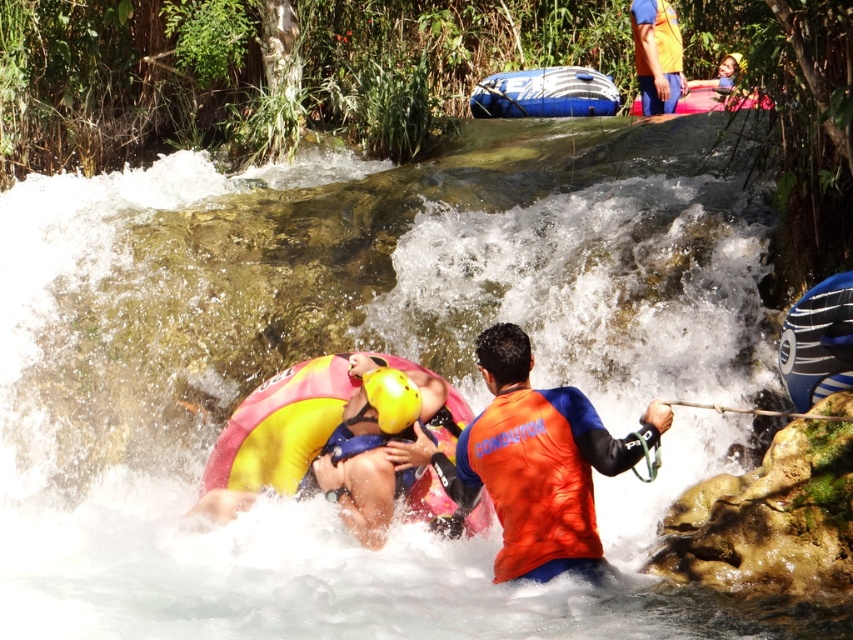
Does yellow rubber ring at center appear over blue rubber raft at upper center?

Incorrect, yellow rubber ring at center is not positioned above blue rubber raft at upper center.

Who is shorter, yellow rubber ring at center or blue rubber raft at upper center?

blue rubber raft at upper center is shorter.

Is point (363, 432) less distant than point (552, 68)?

Yes, it is in front of point (552, 68).

At what (x,y) coordinates should I click in order to perform the action: click on yellow rubber ring at center. Please return your answer as a coordinate pair (x, y). This screenshot has width=853, height=640. Looking at the image, I should click on (370, 458).

Is yellow matte life jacket at center closer to camera compared to pink rubber raft at upper center?

Yes.

Can you confirm if yellow matte life jacket at center is shorter than pink rubber raft at upper center?

Incorrect, yellow matte life jacket at center's height does not fall short of pink rubber raft at upper center's.

Between point (247, 467) and point (695, 84), which one is positioned behind?

Point (695, 84)

Find the location of a particular element. The image size is (853, 640). yellow matte life jacket at center is located at coordinates (280, 428).

Can you confirm if yellow rubber ring at center is shorter than yellow matte helmet at center?

No.

Image resolution: width=853 pixels, height=640 pixels. Find the location of `yellow rubber ring at center`. yellow rubber ring at center is located at coordinates (370, 458).